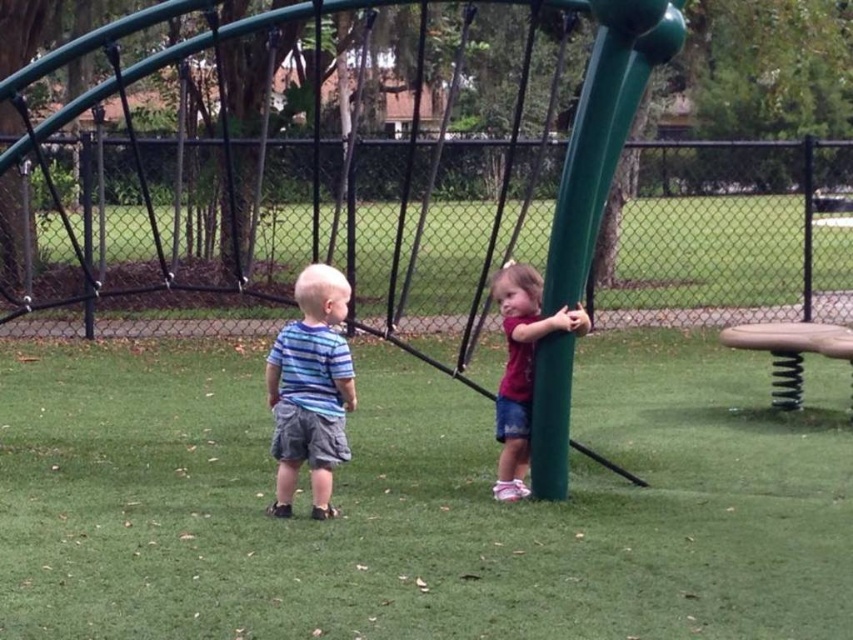
Can you confirm if blue striped shirt at left is thinner than matte green pole at right?

Yes, blue striped shirt at left is thinner than matte green pole at right.

Is blue striped shirt at left positioned behind matte green pole at right?

No, blue striped shirt at left is closer to the viewer.

Image resolution: width=853 pixels, height=640 pixels. What do you see at coordinates (310, 388) in the screenshot?
I see `blue striped shirt at left` at bounding box center [310, 388].

Find the location of a particular element. The width and height of the screenshot is (853, 640). blue striped shirt at left is located at coordinates (310, 388).